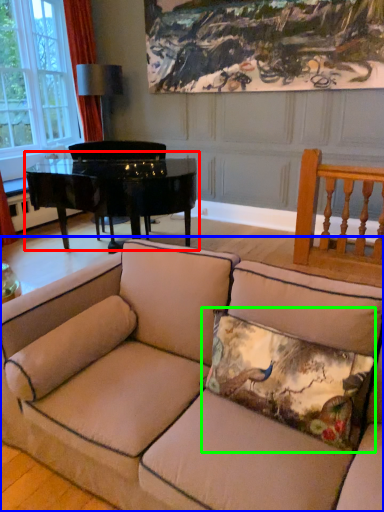
Question: Estimate the real-world distances between objects in this image. Which object is closer to table (highlighted by a red box), studio couch (highlighted by a blue box) or pillow (highlighted by a green box)?

Choices:
 (A) studio couch
 (B) pillow

Answer: (A)